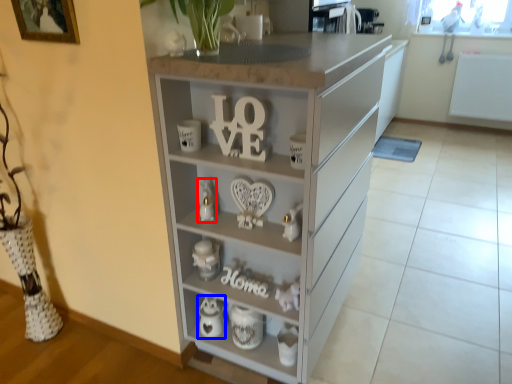
Question: Which point is closer to the camera, toy (highlighted by a red box) or appliance (highlighted by a blue box)?

Choices:
 (A) toy
 (B) appliance

Answer: (A)